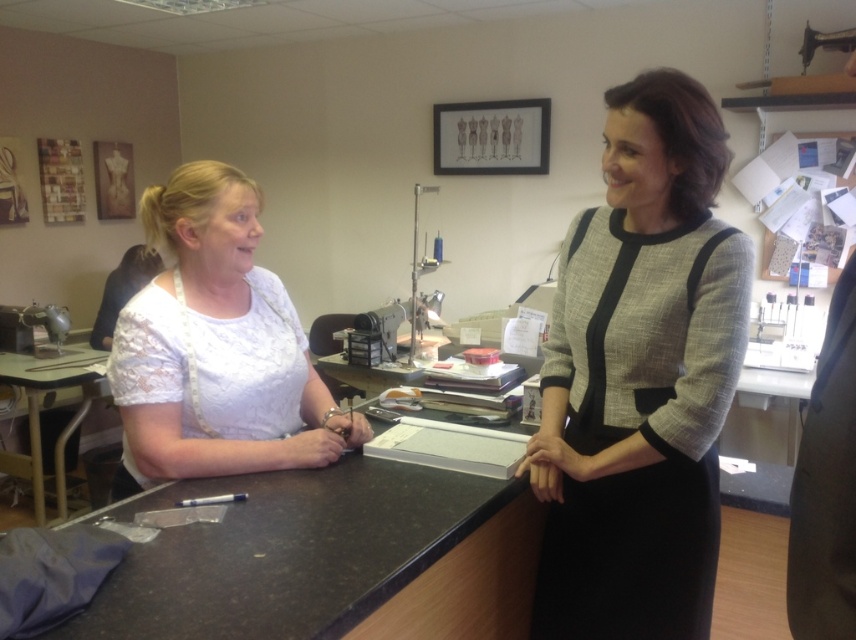
Question: Considering the relative positions of white lace blouse at left and light brown wooden table at lower left in the image provided, where is white lace blouse at left located with respect to light brown wooden table at lower left?

Choices:
 (A) below
 (B) above

Answer: (B)

Question: From the image, what is the correct spatial relationship of matte gray dress at center in relation to white lace blouse at left?

Choices:
 (A) above
 (B) below

Answer: (B)

Question: Among these objects, which one is nearest to the camera?

Choices:
 (A) light brown wooden table at lower left
 (B) white lace blouse at left

Answer: (B)

Question: Which object is positioned farthest from the white lace blouse at left?

Choices:
 (A) light brown wooden table at lower left
 (B) matte gray dress at center

Answer: (A)

Question: Observing the image, what is the correct spatial positioning of white lace blouse at left in reference to light brown wooden table at lower left?

Choices:
 (A) above
 (B) below

Answer: (A)

Question: Which point appears closest to the camera in this image?

Choices:
 (A) (37, 380)
 (B) (610, 481)
 (C) (204, 429)

Answer: (B)